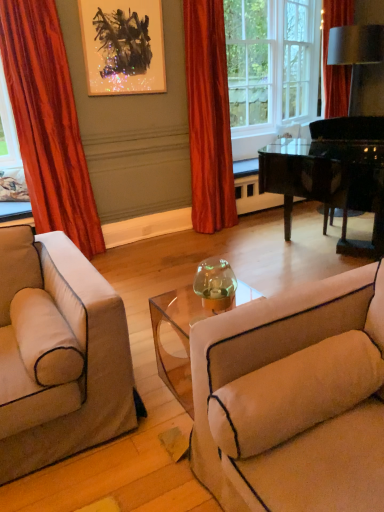
Question: Considering the relative sizes of white glass window frame at upper center and beige fabric couch at lower right in the image provided, is white glass window frame at upper center bigger than beige fabric couch at lower right?

Choices:
 (A) yes
 (B) no

Answer: (A)

Question: From a real-world perspective, is white glass window frame at upper center physically below beige fabric couch at lower right?

Choices:
 (A) yes
 (B) no

Answer: (B)

Question: From a real-world perspective, is white glass window frame at upper center positioned over beige fabric couch at lower right based on gravity?

Choices:
 (A) no
 (B) yes

Answer: (B)

Question: Is white glass window frame at upper center far from beige fabric couch at lower right?

Choices:
 (A) no
 (B) yes

Answer: (B)

Question: From the image's perspective, is white glass window frame at upper center on beige fabric couch at lower right?

Choices:
 (A) yes
 (B) no

Answer: (A)

Question: Does point (208, 464) appear closer or farther from the camera than point (299, 56)?

Choices:
 (A) farther
 (B) closer

Answer: (B)

Question: Looking at the image, does beige fabric couch at lower right seem bigger or smaller compared to white glass window frame at upper center?

Choices:
 (A) big
 (B) small

Answer: (B)

Question: Based on their positions, is beige fabric couch at lower right located to the left or right of white glass window frame at upper center?

Choices:
 (A) right
 (B) left

Answer: (B)

Question: Do you think beige fabric couch at lower right is within white glass window frame at upper center, or outside of it?

Choices:
 (A) inside
 (B) outside

Answer: (B)

Question: Is point (203, 140) closer or farther from the camera than point (317, 148)?

Choices:
 (A) farther
 (B) closer

Answer: (A)

Question: From a real-world perspective, is silky orange curtain at center, acting as the 2th curtain starting from the left, positioned above or below black glossy piano at center right?

Choices:
 (A) above
 (B) below

Answer: (A)

Question: Is silky orange curtain at center, which is the 1th curtain from right to left, bigger or smaller than black glossy piano at center right?

Choices:
 (A) big
 (B) small

Answer: (B)

Question: In the image, is silky orange curtain at center, which is the 1th curtain from right to left, on the left side or the right side of black glossy piano at center right?

Choices:
 (A) left
 (B) right

Answer: (A)

Question: Is black glossy piano at center right bigger or smaller than silky orange curtain at center, acting as the 2th curtain starting from the left?

Choices:
 (A) big
 (B) small

Answer: (A)

Question: Considering the positions of black glossy piano at center right and silky orange curtain at center, acting as the 2th curtain starting from the left, in the image, is black glossy piano at center right wider or thinner than silky orange curtain at center, acting as the 2th curtain starting from the left,?

Choices:
 (A) wide
 (B) thin

Answer: (A)